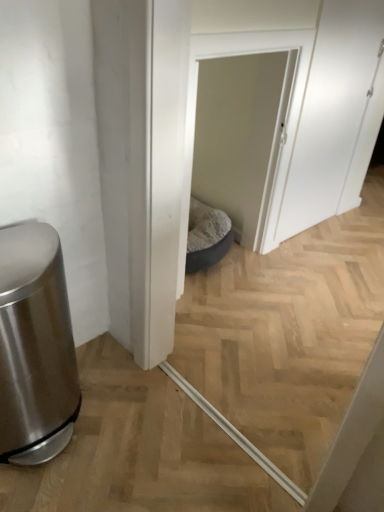
Question: Can we say brushed metal trash can at left lies outside white matte screen door at upper right, the second screen door when ordered from left to right?

Choices:
 (A) yes
 (B) no

Answer: (A)

Question: Is brushed metal trash can at left aimed at white matte screen door at upper right, which is the 1th screen door from right to left?

Choices:
 (A) yes
 (B) no

Answer: (B)

Question: Considering the relative positions of brushed metal trash can at left and white matte screen door at upper right, the second screen door when ordered from left to right, in the image provided, is brushed metal trash can at left in front of white matte screen door at upper right, the second screen door when ordered from left to right,?

Choices:
 (A) no
 (B) yes

Answer: (B)

Question: Are brushed metal trash can at left and white matte screen door at upper right, the second screen door when ordered from left to right, making contact?

Choices:
 (A) no
 (B) yes

Answer: (A)

Question: Is brushed metal trash can at left smaller than white matte screen door at upper right, the second screen door when ordered from left to right?

Choices:
 (A) yes
 (B) no

Answer: (B)

Question: Based on their sizes in the image, would you say white matte screen door at upper right, the second screen door when ordered from left to right, is bigger or smaller than white fabric pet bed at center, the second screen door when ordered from right to left?

Choices:
 (A) big
 (B) small

Answer: (A)

Question: From the image's perspective, is white matte screen door at upper right, the second screen door when ordered from left to right, located above or below white fabric pet bed at center, arranged as the 1th screen door when viewed from the left?

Choices:
 (A) above
 (B) below

Answer: (A)

Question: Would you say white matte screen door at upper right, the second screen door when ordered from left to right, is to the left or to the right of white fabric pet bed at center, arranged as the 1th screen door when viewed from the left, in the picture?

Choices:
 (A) right
 (B) left

Answer: (A)

Question: Considering the positions of point (365, 5) and point (264, 95), is point (365, 5) closer or farther from the camera than point (264, 95)?

Choices:
 (A) farther
 (B) closer

Answer: (B)

Question: From a real-world perspective, is white fabric pet bed at center, arranged as the 1th screen door when viewed from the left, above or below white matte screen door at upper right, the second screen door when ordered from left to right?

Choices:
 (A) above
 (B) below

Answer: (B)

Question: Is white fabric pet bed at center, the second screen door when ordered from right to left, bigger or smaller than white matte screen door at upper right, which is the 1th screen door from right to left?

Choices:
 (A) big
 (B) small

Answer: (B)

Question: From the image's perspective, is white fabric pet bed at center, arranged as the 1th screen door when viewed from the left, above or below white matte screen door at upper right, which is the 1th screen door from right to left?

Choices:
 (A) above
 (B) below

Answer: (B)

Question: Choose the correct answer: Is white fabric pet bed at center, the second screen door when ordered from right to left, inside white matte screen door at upper right, the second screen door when ordered from left to right, or outside it?

Choices:
 (A) outside
 (B) inside

Answer: (A)

Question: In the image, is white matte screen door at upper right, which is the 1th screen door from right to left, positioned in front of or behind brushed metal trash can at left?

Choices:
 (A) behind
 (B) front

Answer: (A)

Question: Considering the positions of point (359, 84) and point (41, 340), is point (359, 84) closer or farther from the camera than point (41, 340)?

Choices:
 (A) farther
 (B) closer

Answer: (A)